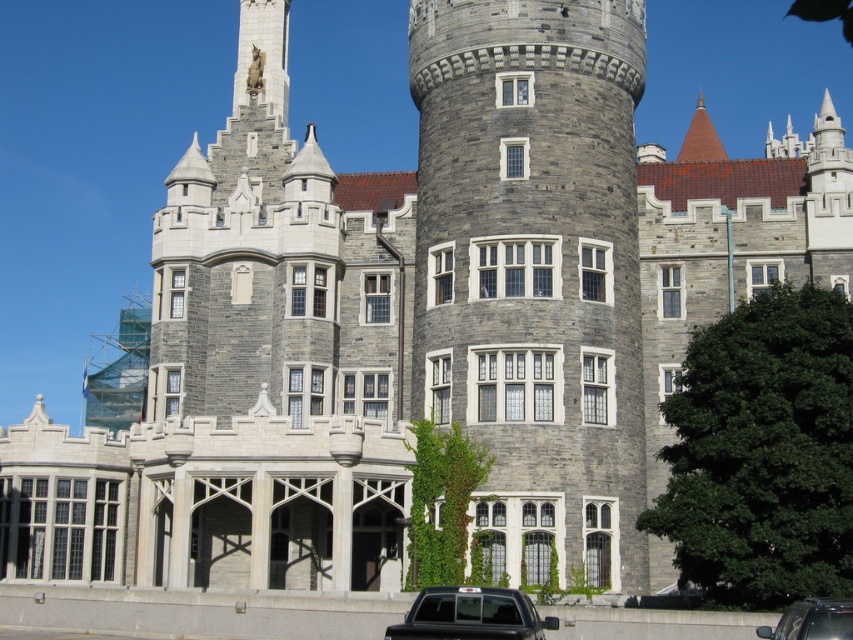
You are standing in front of the gray stone tower at center and want to see the metallic silver car at lower right. Can you see it without moving your head?

The metallic silver car at lower right is behind the gray stone tower at center, so you cannot see it without moving your head.

In the scene shown: You are a visitor arriving at the castle and see the black matte truck at lower center and the metallic silver car at lower right parked nearby. Which vehicle is closer to the castle entrance?

The black matte truck at lower center is positioned on the left side of metallic silver car at lower right, so the truck is closer to the castle entrance as it is to the left of the car.

You are standing in front of the castle building and notice the gray stone tower at center and the black matte truck at lower center. Which object is located to the right of the other?

The gray stone tower at center is positioned on the right side of black matte truck at lower center, so the gray stone tower at center is to the right of the black matte truck at lower center.